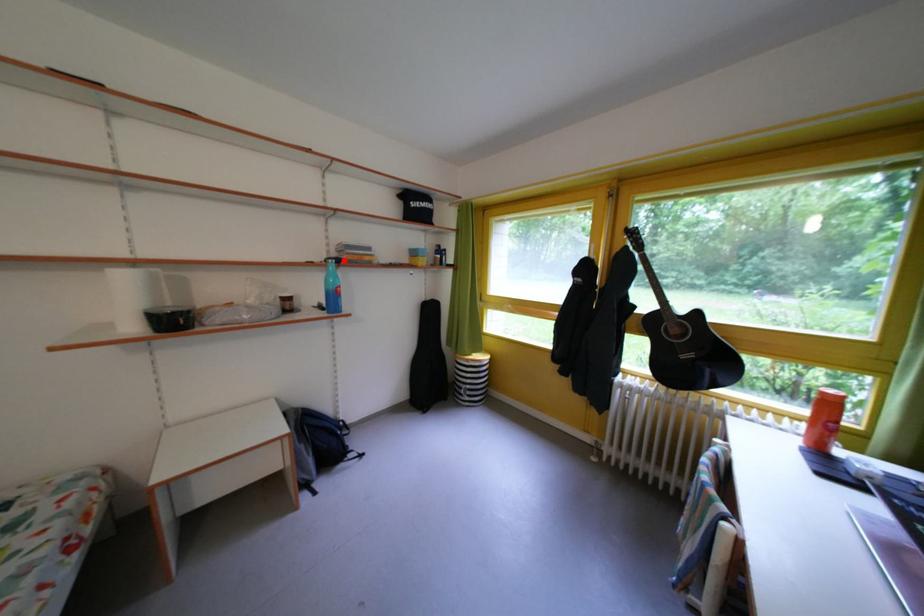
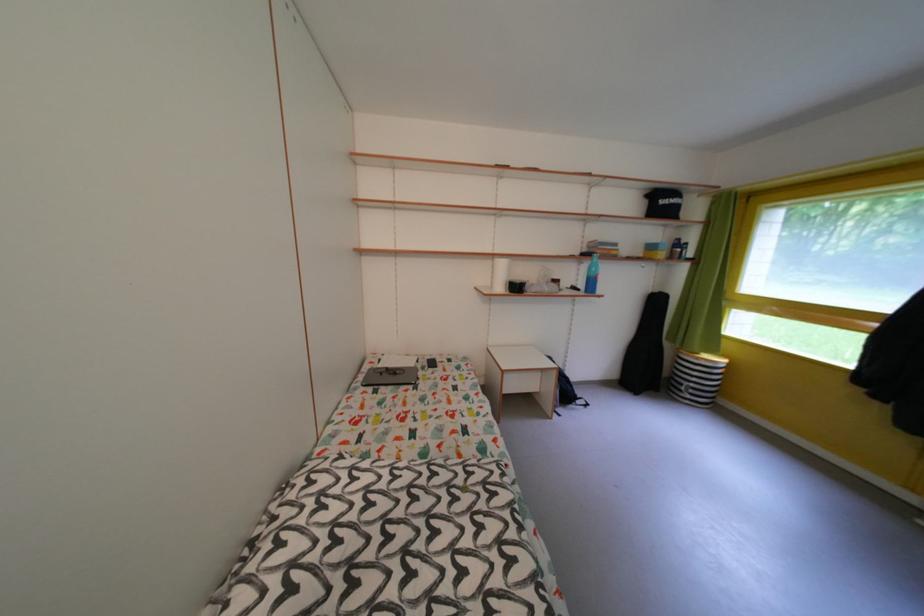
The point at the highlighted location is marked in the first image. Where is the corresponding point in the second image?

(594, 256)